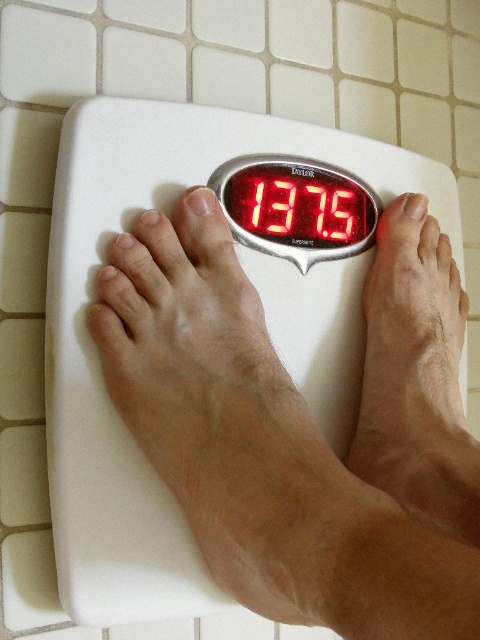
Is white plastic scale at center below red digital display at center?

Indeed, white plastic scale at center is positioned under red digital display at center.

Does white plastic scale at center have a greater height compared to red digital display at center?

Indeed, white plastic scale at center has a greater height compared to red digital display at center.

Does point (100, 262) come closer to viewer compared to point (359, 182)?

That is True.

At what (x,y) coordinates should I click in order to perform the action: click on white plastic scale at center. Please return your answer as a coordinate pair (x, y). The height and width of the screenshot is (640, 480). Looking at the image, I should click on (96, 352).